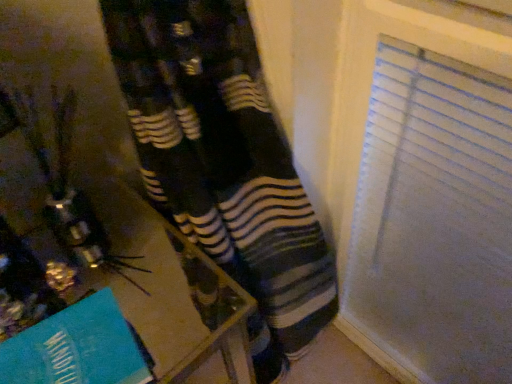
Question: Is wooden table at lower left wider or thinner than teal paper at lower left?

Choices:
 (A) wide
 (B) thin

Answer: (A)

Question: From the image's perspective, is wooden table at lower left located above or below teal paper at lower left?

Choices:
 (A) above
 (B) below

Answer: (B)

Question: Based on their positions, is wooden table at lower left located to the left or right of teal paper at lower left?

Choices:
 (A) left
 (B) right

Answer: (B)

Question: Considering the positions of teal paper at lower left and wooden table at lower left in the image, is teal paper at lower left taller or shorter than wooden table at lower left?

Choices:
 (A) tall
 (B) short

Answer: (B)

Question: Considering the positions of point (82, 336) and point (36, 296), is point (82, 336) closer or farther from the camera than point (36, 296)?

Choices:
 (A) closer
 (B) farther

Answer: (A)

Question: Based on their sizes in the image, would you say teal paper at lower left is bigger or smaller than wooden table at lower left?

Choices:
 (A) big
 (B) small

Answer: (B)

Question: Is teal paper at lower left inside or outside of wooden table at lower left?

Choices:
 (A) outside
 (B) inside

Answer: (A)